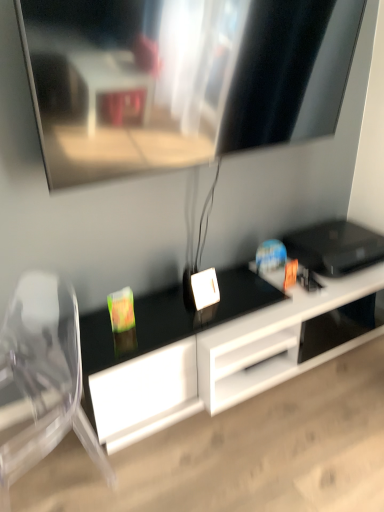
The image size is (384, 512). What are the coordinates of `vacant area on top of black glossy desk at center (from a real-world perspective)` in the screenshot? It's located at (235, 304).